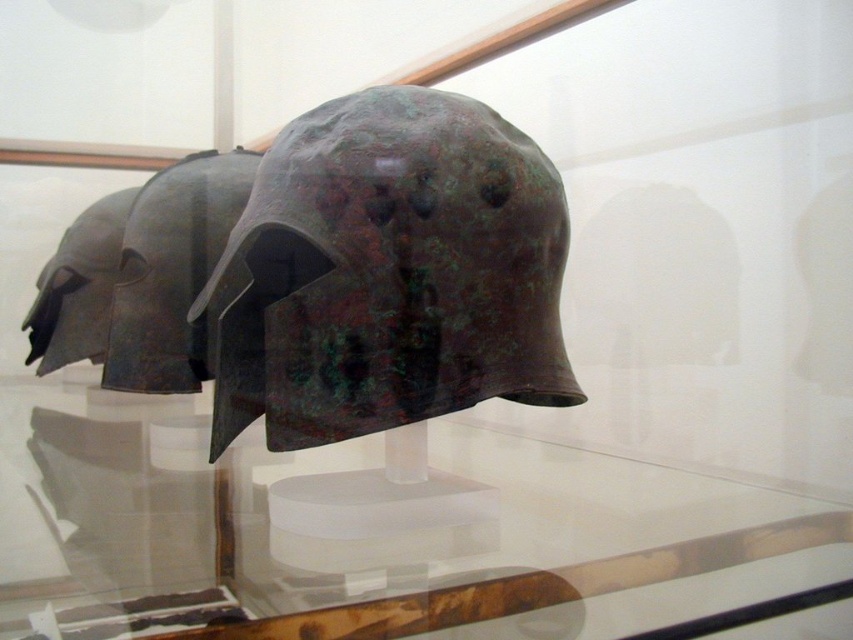
Is transparent glass table at center closer to the viewer compared to green patina metal helmet at center?

Yes, transparent glass table at center is closer to the viewer.

Is transparent glass table at center taller than green patina metal helmet at center?

No.

This screenshot has height=640, width=853. I want to click on transparent glass table at center, so click(x=370, y=540).